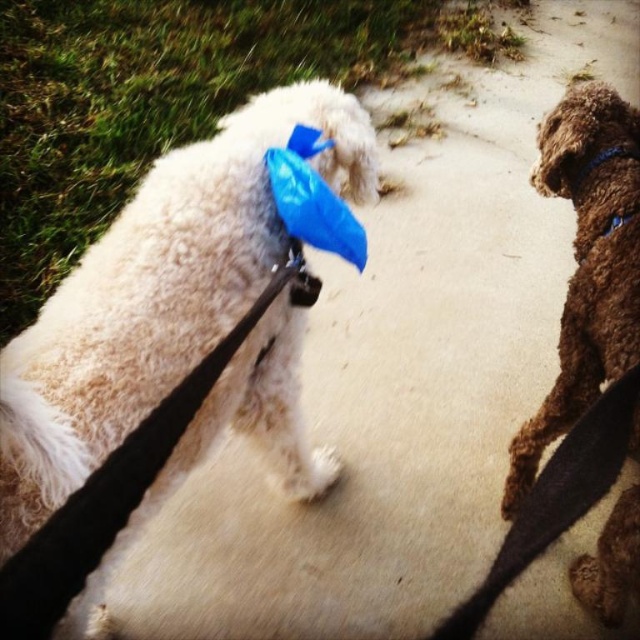
Can you confirm if brown fuzzy dog at right is shorter than black leather leash at lower right?

In fact, brown fuzzy dog at right may be taller than black leather leash at lower right.

Does brown fuzzy dog at right have a larger size compared to black leather leash at lower right?

Actually, brown fuzzy dog at right might be smaller than black leather leash at lower right.

Between point (588, 276) and point (589, 417), which one is positioned behind?

Positioned behind is point (588, 276).

At what (x,y) coordinates should I click in order to perform the action: click on brown fuzzy dog at right. Please return your answer as a coordinate pair (x, y). The width and height of the screenshot is (640, 640). Looking at the image, I should click on (586, 262).

Is white fluffy dog at upper left bigger than brown fuzzy dog at right?

Correct, white fluffy dog at upper left is larger in size than brown fuzzy dog at right.

Between point (113, 356) and point (602, 280), which one is positioned in front?

Point (113, 356) is more forward.

Which is in front, point (298, 474) or point (627, 240)?

Positioned in front is point (627, 240).

This screenshot has height=640, width=640. Identify the location of white fluffy dog at upper left. (157, 294).

Is white fluffy dog at upper left bigger than black leather leash at lower right?

Correct, white fluffy dog at upper left is larger in size than black leather leash at lower right.

Can you confirm if white fluffy dog at upper left is positioned to the left of black leather leash at lower right?

Indeed, white fluffy dog at upper left is positioned on the left side of black leather leash at lower right.

Who is more forward, (253, 358) or (456, 612)?

Point (253, 358)

What are the coordinates of `white fluffy dog at upper left` in the screenshot? It's located at (157, 294).